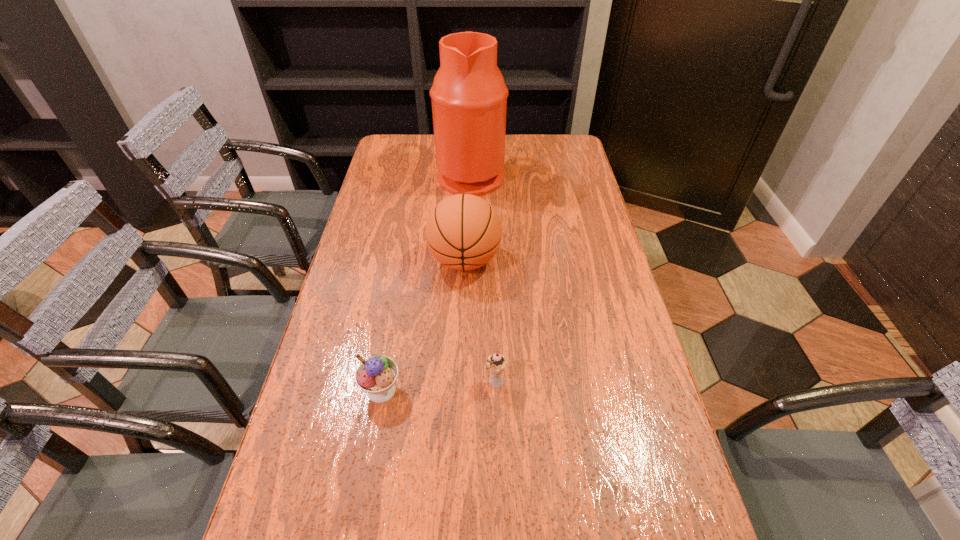
At what (x,y) coordinates should I click in order to perform the action: click on the tallest object. Please return your answer as a coordinate pair (x, y). Looking at the image, I should click on (469, 96).

This screenshot has height=540, width=960. Identify the location of the farthest object. (469, 96).

You are a GUI agent. You are given a task and a screenshot of the screen. Output one action in this format:
    pyautogui.click(x=<x>, y=<y>)
    Task: Click on the basketball
    
    Given the screenshot: What is the action you would take?
    pyautogui.click(x=463, y=232)

Locate an element on the screen. The width and height of the screenshot is (960, 540). the third shortest object is located at coordinates (463, 232).

I want to click on the right icecream, so click(496, 363).

Where is `the leftmost object`? This screenshot has width=960, height=540. the leftmost object is located at coordinates (377, 375).

Where is `blank area located 0.220m from the spout of the farthest object`? Image resolution: width=960 pixels, height=540 pixels. blank area located 0.220m from the spout of the farthest object is located at coordinates (564, 175).

This screenshot has height=540, width=960. I want to click on vacant region located on the right of the third shortest object, so click(x=605, y=260).

The width and height of the screenshot is (960, 540). I want to click on vacant region located on the left of the right icecream, so click(325, 383).

Identify the location of free location located 0.330m on the back of the leftmost object. (402, 274).